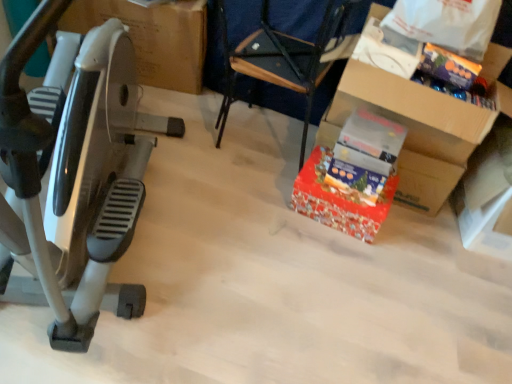
Question: Is shiny purple candy at upper right, which appears as the second gift when viewed from the left, smaller than blue fabric armchair at center?

Choices:
 (A) no
 (B) yes

Answer: (B)

Question: Is shiny purple candy at upper right, acting as the first gift starting from the top, in contact with blue fabric armchair at center?

Choices:
 (A) no
 (B) yes

Answer: (A)

Question: Is shiny purple candy at upper right, the first gift from the right, far away from blue fabric armchair at center?

Choices:
 (A) no
 (B) yes

Answer: (A)

Question: Is shiny purple candy at upper right, the first gift from the right, thinner than blue fabric armchair at center?

Choices:
 (A) no
 (B) yes

Answer: (B)

Question: Is blue fabric armchair at center located within shiny purple candy at upper right, which appears as the second gift when viewed from the left?

Choices:
 (A) no
 (B) yes

Answer: (A)

Question: Looking at the image, does white cardboard box at right seem bigger or smaller compared to red glossy gift at center, the second gift in the top-to-bottom sequence?

Choices:
 (A) big
 (B) small

Answer: (A)

Question: From a real-world perspective, is white cardboard box at right physically located above or below red glossy gift at center, which appears as the 1th gift when viewed from the left?

Choices:
 (A) below
 (B) above

Answer: (B)

Question: Would you say white cardboard box at right is inside or outside red glossy gift at center, positioned as the 1th gift in bottom-to-top order?

Choices:
 (A) outside
 (B) inside

Answer: (A)

Question: From the image's perspective, is white cardboard box at right positioned above or below red glossy gift at center, positioned as the 1th gift in bottom-to-top order?

Choices:
 (A) above
 (B) below

Answer: (B)

Question: Is silver metallic stationary bicycle at left to the left or to the right of white plastic bag at upper right in the image?

Choices:
 (A) left
 (B) right

Answer: (A)

Question: From a real-world perspective, is silver metallic stationary bicycle at left above or below white plastic bag at upper right?

Choices:
 (A) below
 (B) above

Answer: (A)

Question: Looking at their shapes, would you say silver metallic stationary bicycle at left is wider or thinner than white plastic bag at upper right?

Choices:
 (A) wide
 (B) thin

Answer: (A)

Question: From their relative heights in the image, would you say silver metallic stationary bicycle at left is taller or shorter than white plastic bag at upper right?

Choices:
 (A) tall
 (B) short

Answer: (A)

Question: In terms of size, does white cardboard box at right appear bigger or smaller than silver metallic stationary bicycle at left?

Choices:
 (A) big
 (B) small

Answer: (B)

Question: From the image's perspective, is white cardboard box at right positioned above or below silver metallic stationary bicycle at left?

Choices:
 (A) above
 (B) below

Answer: (B)